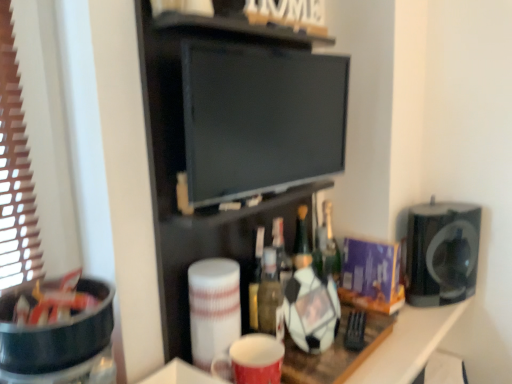
Question: From a real-world perspective, is translucent glass bottle at center positioned above or below black matte speaker at right, placed as the first appliance when sorted from back to front?

Choices:
 (A) above
 (B) below

Answer: (A)

Question: Considering the relative positions of translucent glass bottle at center and black matte speaker at right, the first appliance when ordered from right to left, in the image provided, is translucent glass bottle at center to the left or to the right of black matte speaker at right, the first appliance when ordered from right to left,?

Choices:
 (A) left
 (B) right

Answer: (A)

Question: Considering the real-world distances, which object is closest to the translucent glass bottle at center?

Choices:
 (A) black plastic bowl at left, which is the second appliance in right-to-left order
 (B) matte red mug at center
 (C) black glossy flat screen tv at center
 (D) black matte speaker at right, the 2th appliance positioned from the left
 (E) black matte tv at center

Answer: (D)

Question: Estimate the real-world distances between objects in this image. Which object is farther from the black matte speaker at right, placed as the first appliance when sorted from back to front?

Choices:
 (A) black matte tv at center
 (B) black glossy flat screen tv at center
 (C) black plastic bowl at left, which is the second appliance in right-to-left order
 (D) translucent glass bottle at center
 (E) matte red mug at center

Answer: (C)